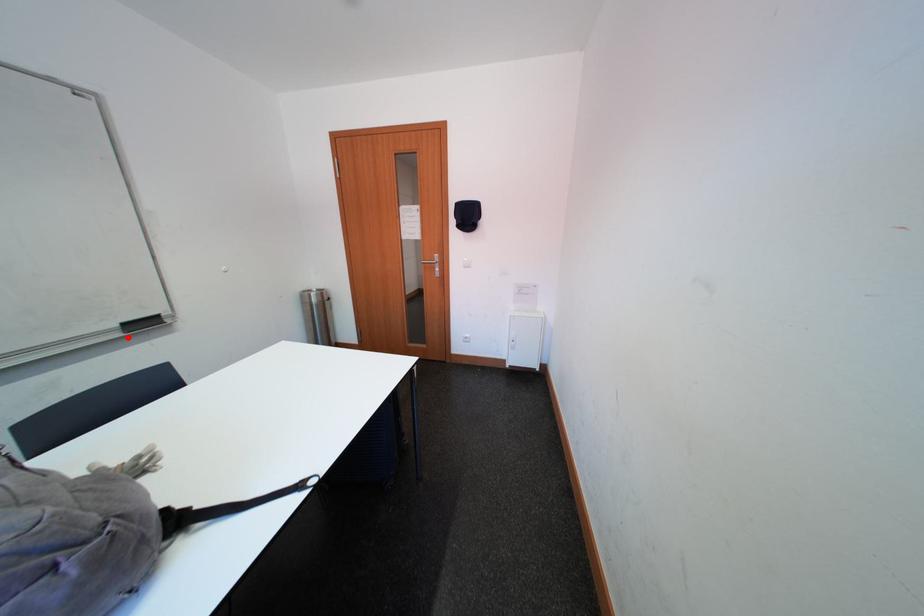
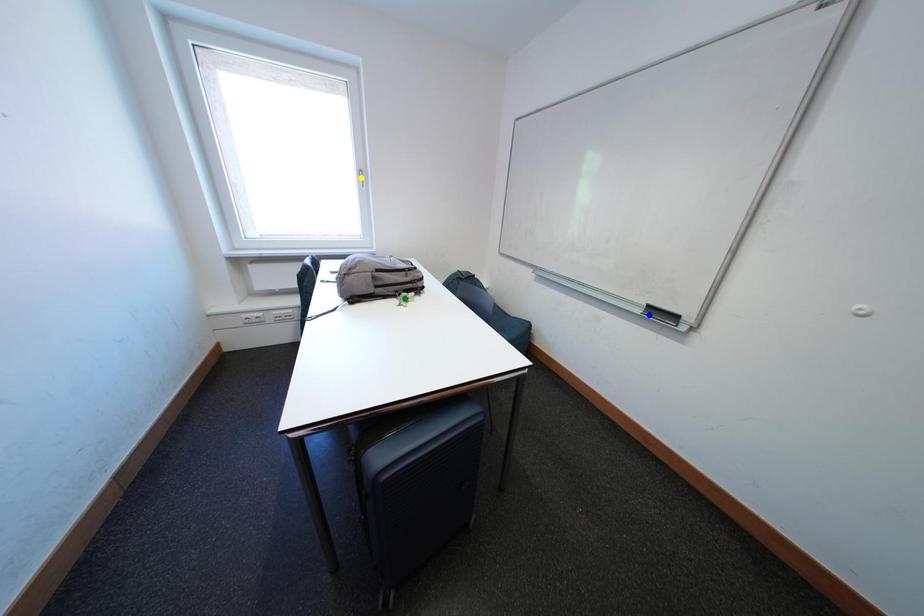
Question: I am providing you with two images of the same scene from different viewpoints. A red point is marked on the first image. You are given multiple points on the second image. In image 2, which mark is for the same physical point as the one in image 1?

Choices:
 (A) yellow point
 (B) blue point
 (C) green point

Answer: (B)